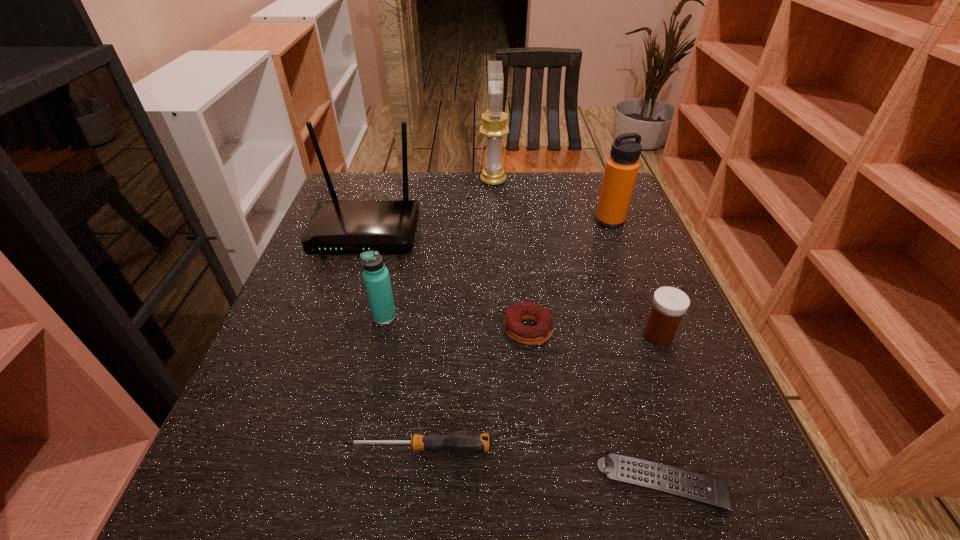
Identify the location of vacant space that is in between the doughnut and the nearer thermos bottle. This screenshot has width=960, height=540. (456, 323).

The width and height of the screenshot is (960, 540). I want to click on empty space that is in between the taller thermos bottle and the router, so click(x=488, y=227).

Identify the location of unoccupied area between the remote control and the screwdriver. The image size is (960, 540). (540, 467).

In order to click on vacant space that's between the fourth shortest object and the farther thermos bottle in this screenshot , I will do `click(634, 278)`.

Locate an element on the screen. Image resolution: width=960 pixels, height=540 pixels. free space between the doughnut and the screwdriver is located at coordinates (473, 389).

Identify the location of empty space that is in between the remote control and the shorter thermos bottle. (523, 401).

At what (x,y) coordinates should I click in order to perform the action: click on the third closest object to the router. Please return your answer as a coordinate pair (x, y). The height and width of the screenshot is (540, 960). Looking at the image, I should click on (530, 335).

Locate which object ranks second in proximity to the right thermos bottle. Please provide its 2D coordinates. Your answer should be formatted as a tuple, i.e. [(x, y)], where the tuple contains the x and y coordinates of a point satisfying the conditions above.

[(669, 304)]

Where is `free location that satisfies the following two spatial constraints: 1. on the front-facing side of the router; 2. on the right side of the fourth tallest object`? free location that satisfies the following two spatial constraints: 1. on the front-facing side of the router; 2. on the right side of the fourth tallest object is located at coordinates (339, 316).

The height and width of the screenshot is (540, 960). Find the location of `free space that satisfies the following two spatial constraints: 1. on the front-facing side of the tallest object; 2. on the front side of the screwdriver`. free space that satisfies the following two spatial constraints: 1. on the front-facing side of the tallest object; 2. on the front side of the screwdriver is located at coordinates (505, 448).